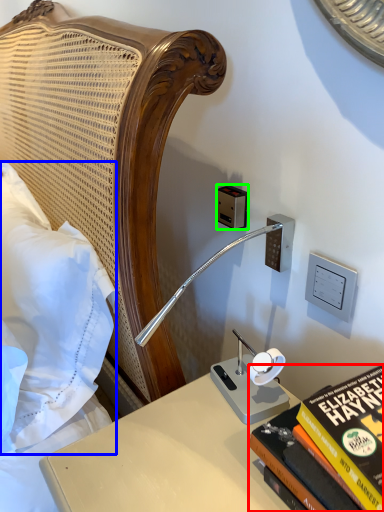
Question: Estimate the real-world distances between objects in this image. Which object is closer to book (highlighted by a red box), pillow (highlighted by a blue box) or electric outlet (highlighted by a green box)?

Choices:
 (A) pillow
 (B) electric outlet

Answer: (B)